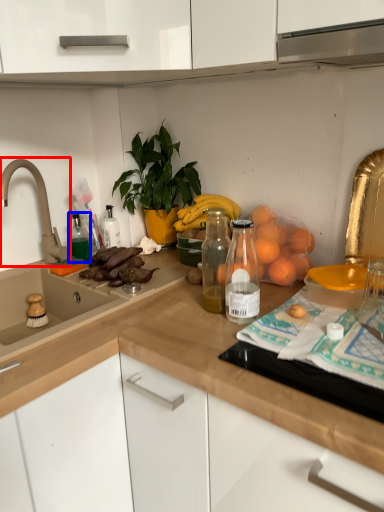
Question: Among these objects, which one is nearest to the camera, tap (highlighted by a red box) or bottle (highlighted by a blue box)?

Choices:
 (A) tap
 (B) bottle

Answer: (A)